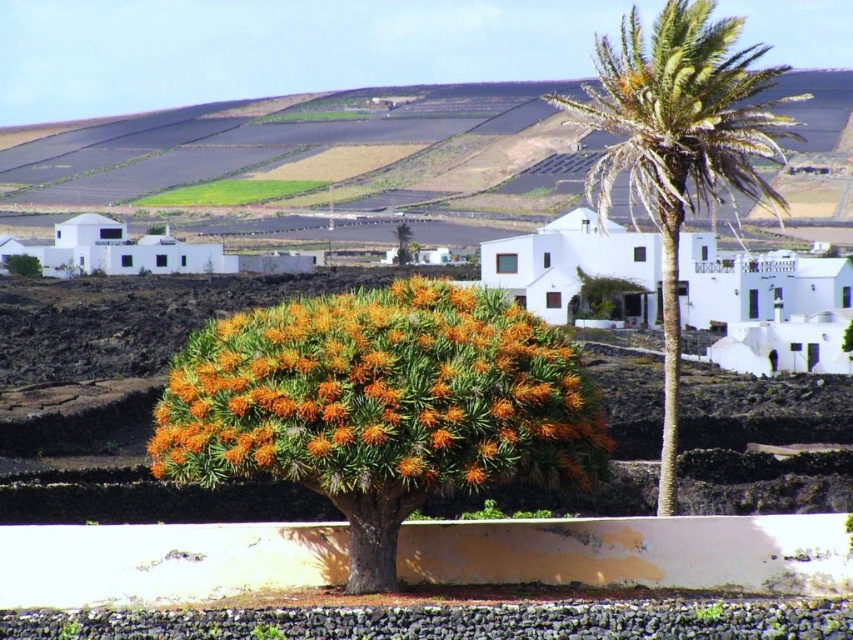
Does orange fuzzy bush at center appear under green leafy palm at upper right?

Indeed, orange fuzzy bush at center is positioned under green leafy palm at upper right.

Does orange fuzzy bush at center have a lesser width compared to green leafy palm at upper right?

Correct, orange fuzzy bush at center's width is less than green leafy palm at upper right's.

This screenshot has width=853, height=640. What are the coordinates of `orange fuzzy bush at center` in the screenshot? It's located at (381, 396).

Can you confirm if orange fuzzy bush at center is positioned above orange spiky bush at center?

A: No.

Consider the image. Which of these two, orange fuzzy bush at center or orange spiky bush at center, stands shorter?

With less height is orange fuzzy bush at center.

Identify the location of orange fuzzy bush at center. The height and width of the screenshot is (640, 853). (381, 396).

Is point (619, 104) less distant than point (399, 230)?

Yes, point (619, 104) is closer to viewer.

Can you confirm if green leafy palm at upper right is wider than orange spiky bush at center?

Yes, green leafy palm at upper right is wider than orange spiky bush at center.

Locate an element on the screen. green leafy palm at upper right is located at coordinates (680, 145).